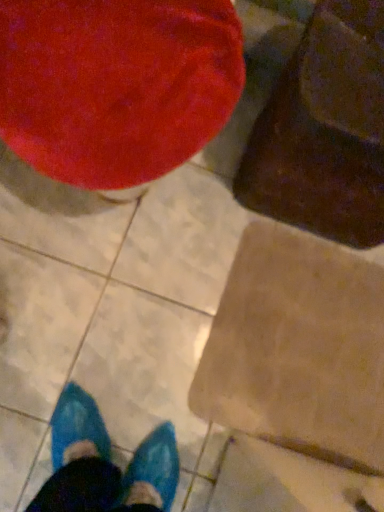
Question: Can you see velvet red bean bag chair at upper left, the first bean bag chair viewed from the left, touching brown cardboard at lower right?

Choices:
 (A) yes
 (B) no

Answer: (B)

Question: Considering the relative sizes of velvet red bean bag chair at upper left, acting as the second bean bag chair starting from the right, and brown cardboard at lower right in the image provided, is velvet red bean bag chair at upper left, acting as the second bean bag chair starting from the right, taller than brown cardboard at lower right?

Choices:
 (A) no
 (B) yes

Answer: (B)

Question: Is the position of velvet red bean bag chair at upper left, the first bean bag chair viewed from the left, less distant than that of brown cardboard at lower right?

Choices:
 (A) yes
 (B) no

Answer: (A)

Question: Could you tell me if velvet red bean bag chair at upper left, acting as the second bean bag chair starting from the right, is facing brown cardboard at lower right?

Choices:
 (A) no
 (B) yes

Answer: (A)

Question: From the image's perspective, is velvet red bean bag chair at upper left, acting as the second bean bag chair starting from the right, above brown cardboard at lower right?

Choices:
 (A) yes
 (B) no

Answer: (A)

Question: Can you confirm if velvet red bean bag chair at upper left, the first bean bag chair viewed from the left, is positioned to the right of brown cardboard at lower right?

Choices:
 (A) yes
 (B) no

Answer: (B)

Question: Considering the relative sizes of velvety brown bean bag chair at upper right, placed as the 1th bean bag chair when sorted from right to left, and brown cardboard at lower right in the image provided, is velvety brown bean bag chair at upper right, placed as the 1th bean bag chair when sorted from right to left, smaller than brown cardboard at lower right?

Choices:
 (A) yes
 (B) no

Answer: (B)

Question: Is brown cardboard at lower right located within velvety brown bean bag chair at upper right, the second bean bag chair viewed from the left?

Choices:
 (A) no
 (B) yes

Answer: (A)

Question: Is velvety brown bean bag chair at upper right, placed as the 1th bean bag chair when sorted from right to left, further to camera compared to brown cardboard at lower right?

Choices:
 (A) no
 (B) yes

Answer: (A)

Question: Is velvety brown bean bag chair at upper right, placed as the 1th bean bag chair when sorted from right to left, to the right of brown cardboard at lower right from the viewer's perspective?

Choices:
 (A) yes
 (B) no

Answer: (A)

Question: Is velvety brown bean bag chair at upper right, the second bean bag chair viewed from the left, oriented towards brown cardboard at lower right?

Choices:
 (A) yes
 (B) no

Answer: (A)

Question: Is velvety brown bean bag chair at upper right, placed as the 1th bean bag chair when sorted from right to left, positioned in front of brown cardboard at lower right?

Choices:
 (A) no
 (B) yes

Answer: (B)

Question: Is velvety brown bean bag chair at upper right, the second bean bag chair viewed from the left, further to camera compared to velvet red bean bag chair at upper left, the first bean bag chair viewed from the left?

Choices:
 (A) no
 (B) yes

Answer: (B)